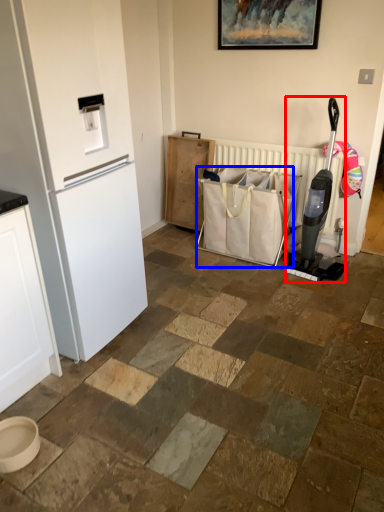
Question: Which point is closer to the camera, appliance (highlighted by a red box) or shopping bag (highlighted by a blue box)?

Choices:
 (A) appliance
 (B) shopping bag

Answer: (A)